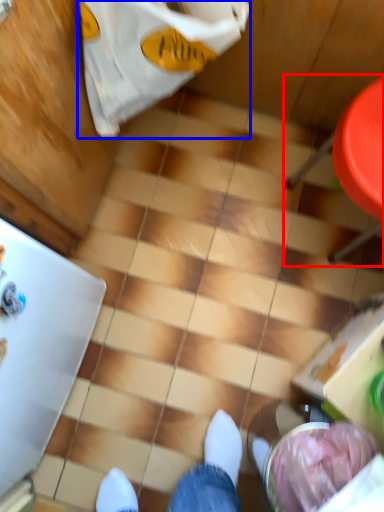
Question: Which object is further to the camera taking this photo, chair (highlighted by a red box) or grocery bag (highlighted by a blue box)?

Choices:
 (A) chair
 (B) grocery bag

Answer: (A)